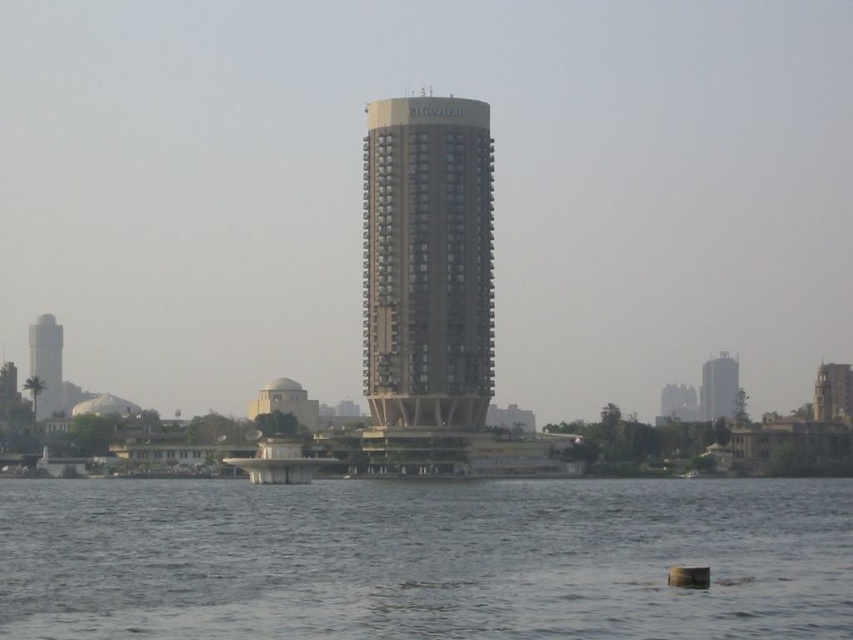
Question: Which object is closer to the camera taking this photo?

Choices:
 (A) gold metallic tower at center
 (B) matte white tower at left
 (C) beige glass tower at center

Answer: (A)

Question: Can you confirm if gold metallic tower at center is wider than matte white tower at left?

Choices:
 (A) no
 (B) yes

Answer: (B)

Question: Can you confirm if gray water at lower center is positioned above gold metallic tower at center?

Choices:
 (A) yes
 (B) no

Answer: (B)

Question: Does gray water at lower center have a smaller size compared to beige glass tower at center?

Choices:
 (A) no
 (B) yes

Answer: (A)

Question: Which point is closer to the camera?

Choices:
 (A) (726, 372)
 (B) (814, 400)
 (C) (59, 376)
 (D) (624, 554)

Answer: (D)

Question: Among these objects, which one is farthest from the camera?

Choices:
 (A) gold metallic tower at center
 (B) matte white tower at left
 (C) beige glass tower at center
 (D) gray water at lower center

Answer: (C)